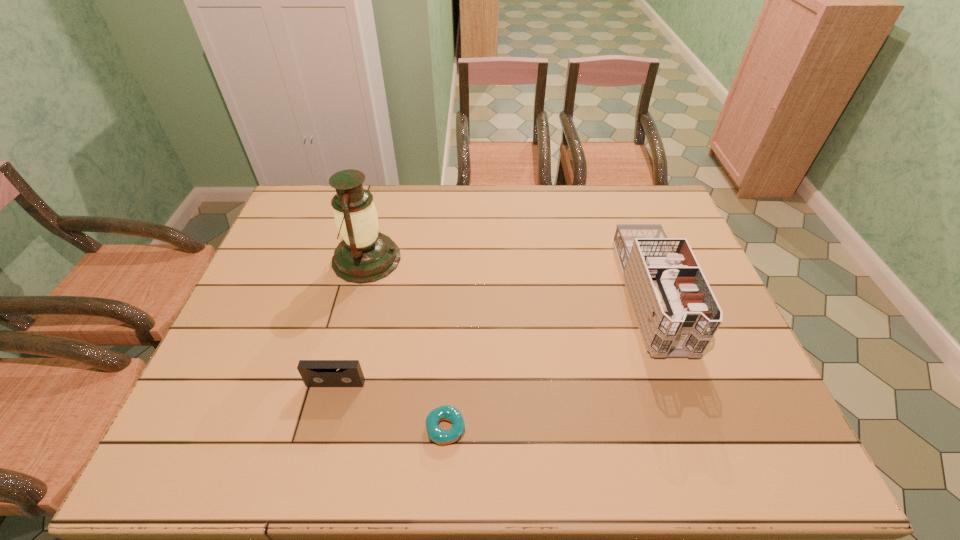
Select which object is the third closest to the tallest object. Please provide its 2D coordinates. Your answer should be formatted as a tuple, i.e. [(x, y)], where the tuple contains the x and y coordinates of a point satisfying the conditions above.

[(677, 314)]

Where is `free space that satisfies the following two spatial constraints: 1. with the light compartment facing forward on the third object from left to right; 2. on the right side of the tallest object`? free space that satisfies the following two spatial constraints: 1. with the light compartment facing forward on the third object from left to right; 2. on the right side of the tallest object is located at coordinates (324, 428).

Identify the location of vacant space that satisfies the following two spatial constraints: 1. on the back side of the doughnut; 2. with the light compartment facing forward on the tallest object. (455, 259).

You are a GUI agent. You are given a task and a screenshot of the screen. Output one action in this format:
    pyautogui.click(x=<x>, y=<y>)
    Task: Click on the vacant region that satisfies the following two spatial constraints: 1. with the light compartment facing forward on the nearest object; 2. on the right side of the tallest object
    This screenshot has height=540, width=960.
    Given the screenshot: What is the action you would take?
    pyautogui.click(x=324, y=428)

You are a GUI agent. You are given a task and a screenshot of the screen. Output one action in this format:
    pyautogui.click(x=<x>, y=<y>)
    Task: Click on the vacant point that satisfies the following two spatial constraints: 1. with the light compartment facing forward on the lantern; 2. on the back side of the third object from left to right
    The image size is (960, 540).
    Given the screenshot: What is the action you would take?
    pyautogui.click(x=324, y=428)

You are a GUI agent. You are given a task and a screenshot of the screen. Output one action in this format:
    pyautogui.click(x=<x>, y=<y>)
    Task: Click on the vacant space that satisfies the following two spatial constraints: 1. on the front-facing side of the doughnut; 2. on the left side of the videotape
    Image resolution: width=960 pixels, height=540 pixels.
    Given the screenshot: What is the action you would take?
    324,428